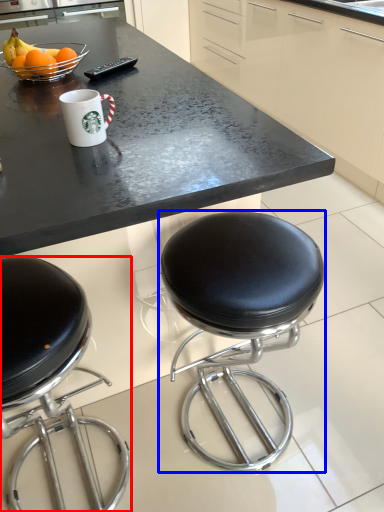
Question: Which of the following is the closest to the observer, chair (highlighted by a red box) or stool (highlighted by a blue box)?

Choices:
 (A) chair
 (B) stool

Answer: (A)